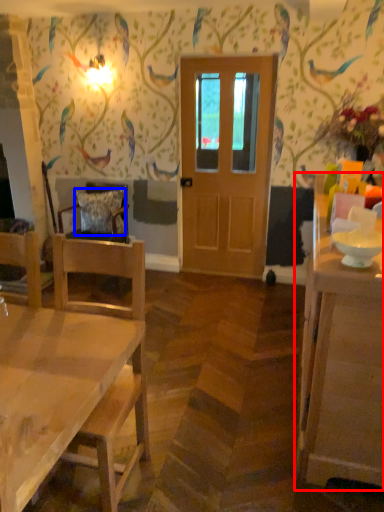
Question: Which object appears closest to the camera in this image, cabinetry (highlighted by a red box) or pillow (highlighted by a blue box)?

Choices:
 (A) cabinetry
 (B) pillow

Answer: (A)